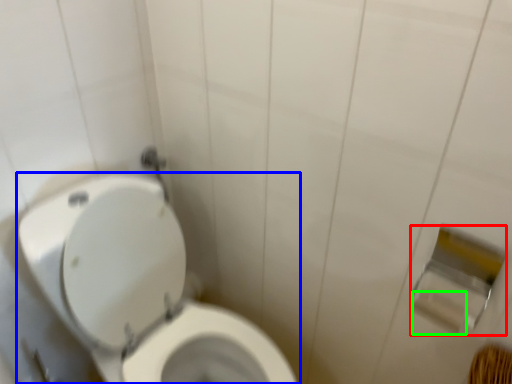
Question: Which object is positioned closest to toilet paper (highlighted by a red box)? Select from toilet (highlighted by a blue box) and toilet paper (highlighted by a green box).

Choices:
 (A) toilet
 (B) toilet paper

Answer: (B)